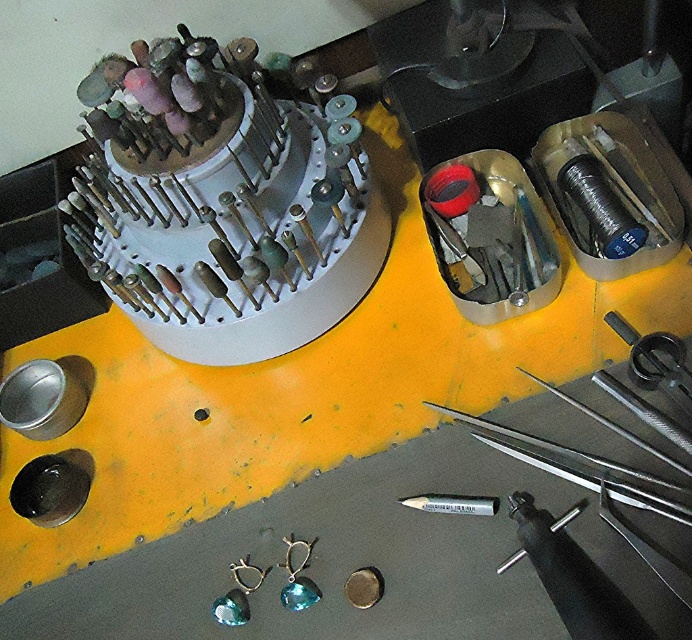
Question: Can you confirm if white plastic grinding wheel at upper center is positioned below silver metallic pen at lower center?

Choices:
 (A) no
 (B) yes

Answer: (A)

Question: Does white plastic grinding wheel at upper center appear on the left side of silver metallic pen at lower center?

Choices:
 (A) no
 (B) yes

Answer: (B)

Question: Which point is farther from the camera taking this photo?

Choices:
 (A) (677, 588)
 (B) (221, 195)

Answer: (B)

Question: Considering the relative positions of white plastic grinding wheel at upper center and silver metallic pen at lower center in the image provided, where is white plastic grinding wheel at upper center located with respect to silver metallic pen at lower center?

Choices:
 (A) above
 (B) below

Answer: (A)

Question: Which object appears farthest from the camera in this image?

Choices:
 (A) white plastic grinding wheel at upper center
 (B) silver metallic pen at lower center

Answer: (A)